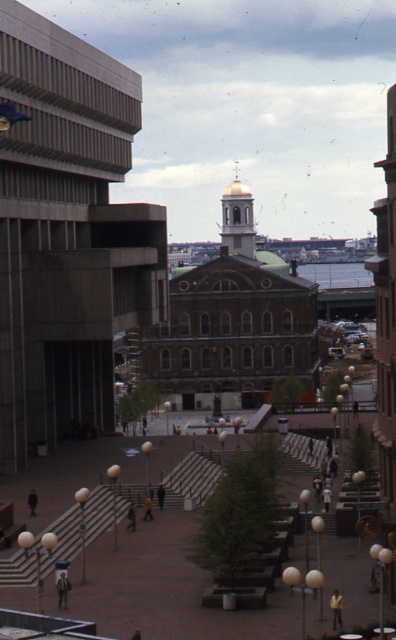
You are standing at the point marked by the coordinates point (66,234), which is on the concrete building at left. You want to walk to the historic building with a dome and clock tower. Which direction should you face to walk directly towards it?

You should face towards the right because the historic building with a dome and clock tower is located to the right of the concrete building at left marked by point (66,234).

You are standing in the middle of the street facing the gold dome at center. Which direction should you turn to see the concrete building at left?

You should turn to your left to see the concrete building at left since it is positioned to the left of the gold dome at center.

You are standing in the middle of the street looking at the historic building with the gold dome at center and the modern concrete building at left. Which structure would appear larger to you based on their positions?

The concrete building at left appears larger because it is closer to the viewer than the gold dome at center.